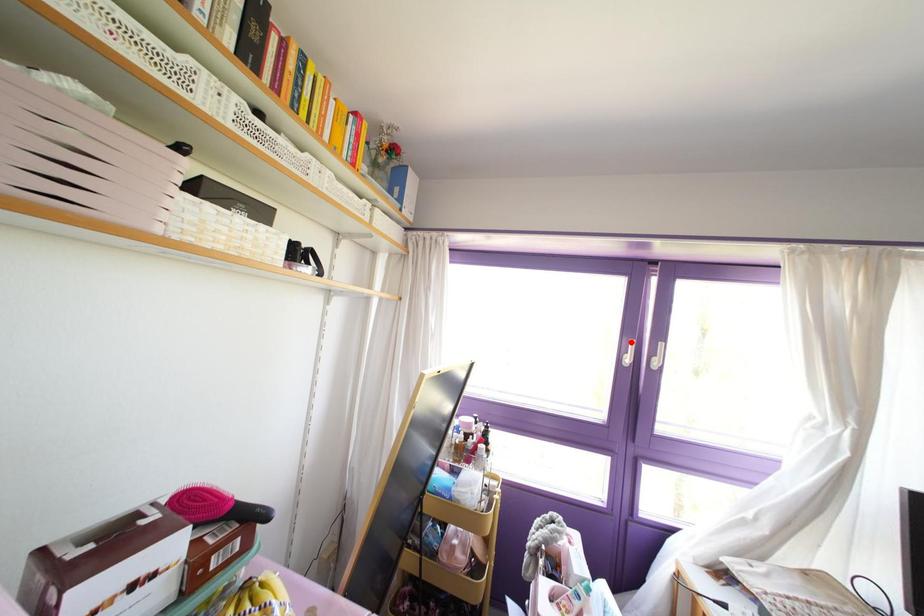
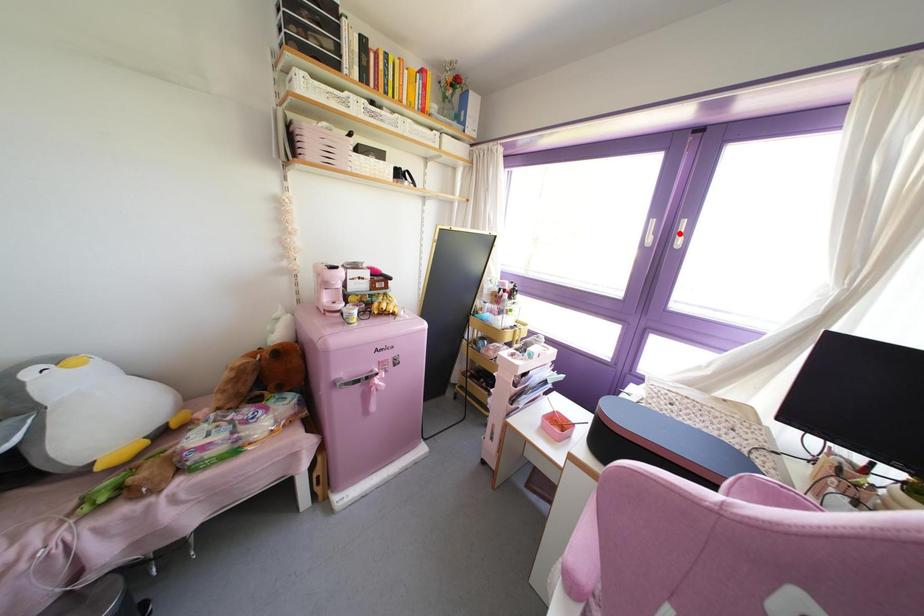
I am providing you with two images of the same scene from different viewpoints. A red point is marked on the first image and another point is marked on the second image. Is the red point in image1 aligned with the point shown in image2?

No